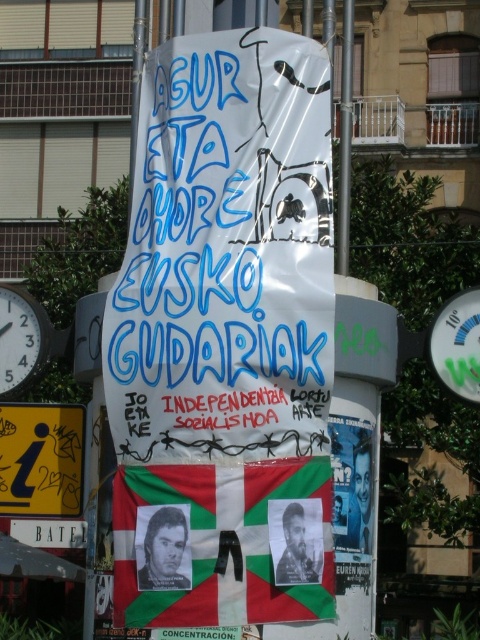
Can you confirm if green and white flag at center is wider than matte black photo at center?

Correct, the width of green and white flag at center exceeds that of matte black photo at center.

Is green and white flag at center further to the viewer compared to matte black photo at center?

No, green and white flag at center is in front of matte black photo at center.

Find the location of a particular element. This screenshot has height=640, width=480. green and white flag at center is located at coordinates click(223, 544).

The width and height of the screenshot is (480, 640). What are the coordinates of `green and white flag at center` in the screenshot? It's located at (223, 544).

Describe the element at coordinates (21, 339) in the screenshot. This screenshot has height=640, width=480. I see `metallic clock face at left` at that location.

How far apart are metallic clock face at left and matte black photo at center?

metallic clock face at left is 5.66 meters away from matte black photo at center.

What do you see at coordinates (21, 339) in the screenshot? This screenshot has height=640, width=480. I see `metallic clock face at left` at bounding box center [21, 339].

At what (x,y) coordinates should I click in order to perform the action: click on metallic clock face at left. Please return your answer as a coordinate pair (x, y). The image size is (480, 640). Looking at the image, I should click on (21, 339).

Does white paper poster at center lie in front of yellow plastic sign at lower left?

Yes.

What do you see at coordinates (226, 256) in the screenshot? I see `white paper poster at center` at bounding box center [226, 256].

Image resolution: width=480 pixels, height=640 pixels. Find the location of `white paper poster at center`. white paper poster at center is located at coordinates (226, 256).